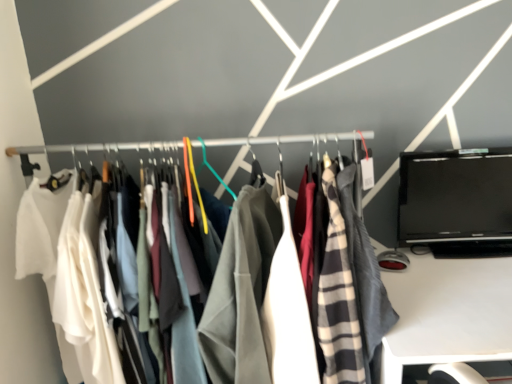
Locate an element on the screen. The height and width of the screenshot is (384, 512). free space in front of black glossy laptop at right is located at coordinates (473, 279).